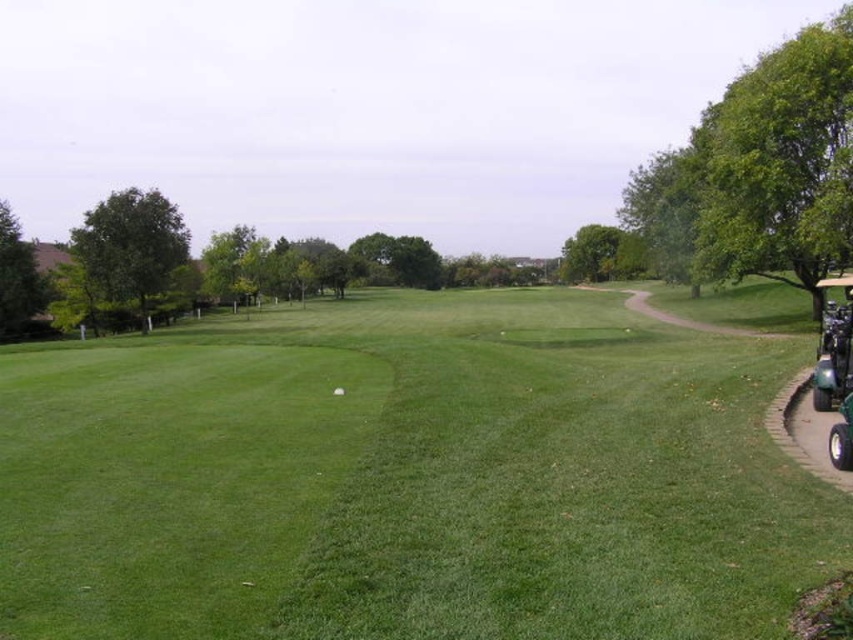
Question: Which point is farther from the camera taking this photo?

Choices:
 (A) (840, 458)
 (B) (618, 403)

Answer: (B)

Question: Can you confirm if green grassy field at center is bigger than green rubber golf cart at right?

Choices:
 (A) yes
 (B) no

Answer: (B)

Question: Does green grassy field at center appear on the right side of green rubber golf cart at right?

Choices:
 (A) yes
 (B) no

Answer: (B)

Question: Can you confirm if green grassy field at center is smaller than green rubber golf cart at right?

Choices:
 (A) yes
 (B) no

Answer: (A)